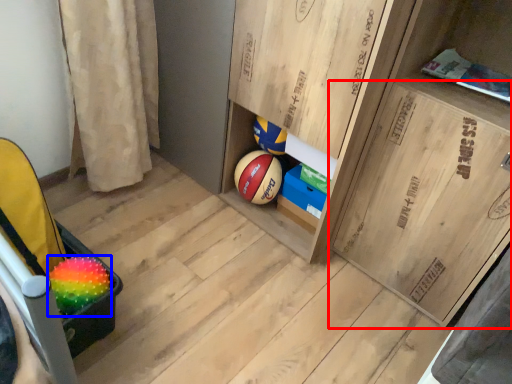
Question: Among these objects, which one is farthest to the camera, cabinetry (highlighted by a red box) or ball (highlighted by a blue box)?

Choices:
 (A) cabinetry
 (B) ball

Answer: (B)